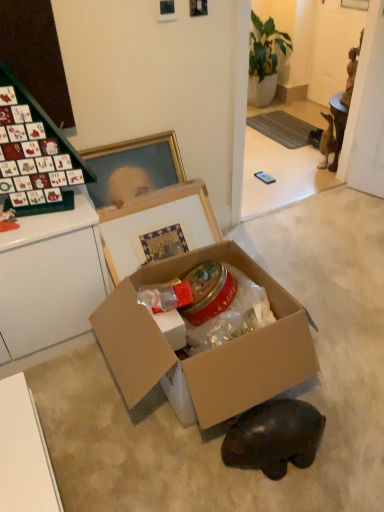
In order to click on free location to the right of shiny black bear at lower center, placed as the first animal when sorted from bottom to top in this screenshot , I will do `click(347, 444)`.